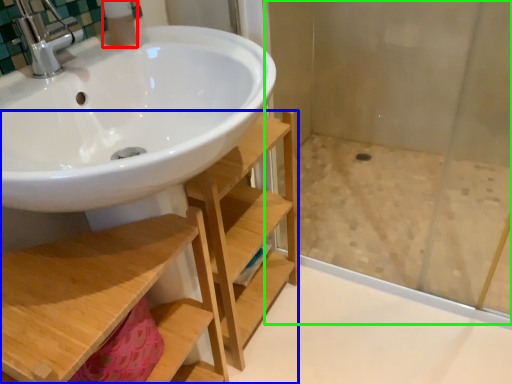
Question: Considering the real-world distances, which object is closest to toiletry (highlighted by a red box)? shelf (highlighted by a blue box) or shower door (highlighted by a green box).

Choices:
 (A) shelf
 (B) shower door

Answer: (A)